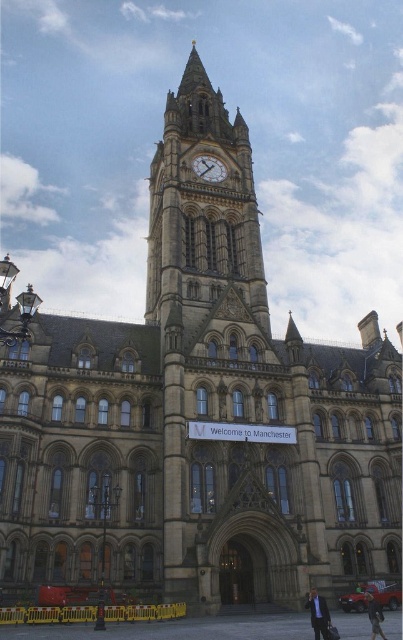
Is golden stone clock tower at center shorter than gold textured clock at center?

Incorrect, golden stone clock tower at center's height does not fall short of gold textured clock at center's.

Who is shorter, golden stone clock tower at center or gold textured clock at center?

gold textured clock at center

The width and height of the screenshot is (403, 640). Describe the element at coordinates (201, 205) in the screenshot. I see `golden stone clock tower at center` at that location.

You are a GUI agent. You are given a task and a screenshot of the screen. Output one action in this format:
    pyautogui.click(x=<x>, y=<y>)
    Task: Click on the golden stone clock tower at center
    The height and width of the screenshot is (640, 403).
    Given the screenshot: What is the action you would take?
    pyautogui.click(x=201, y=205)